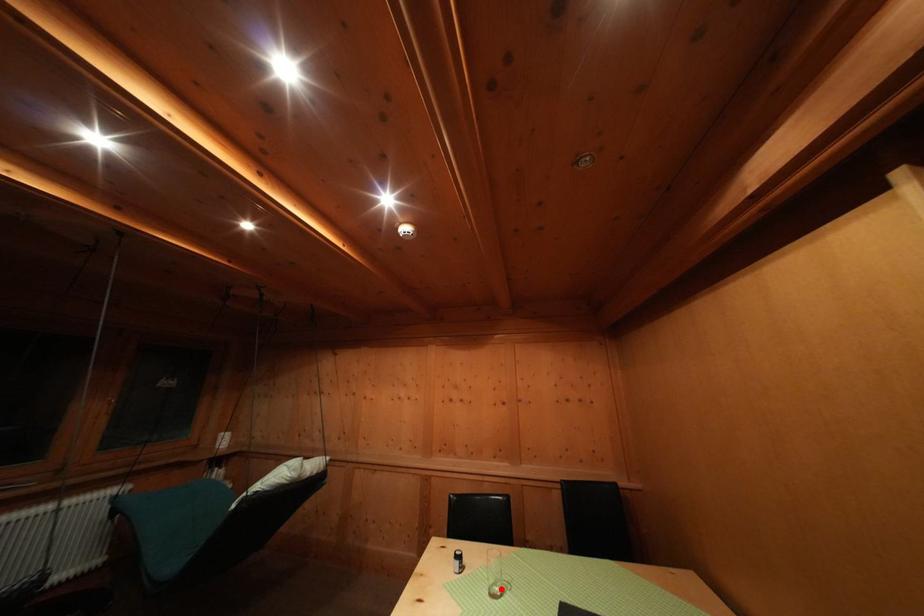
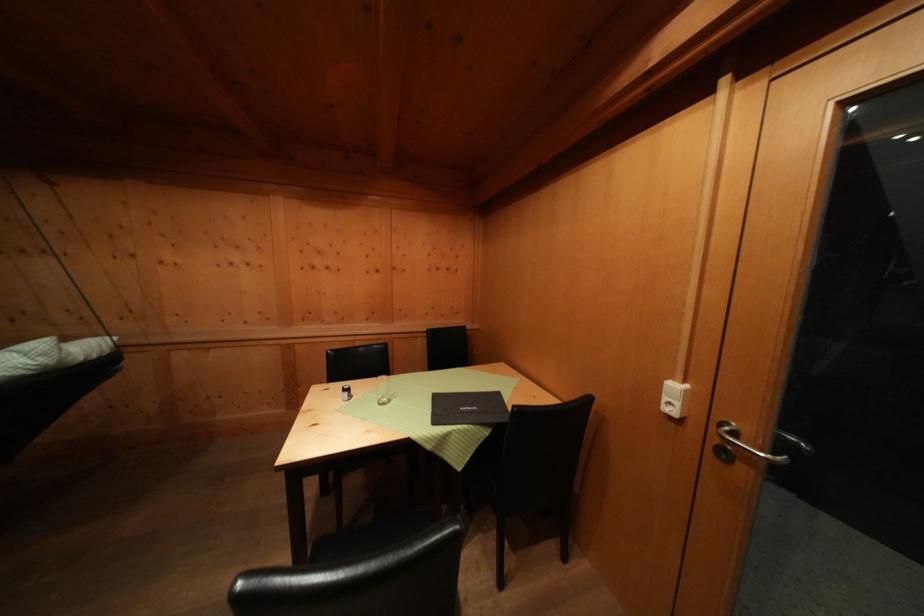
In the second image, find the point that corresponds to the highlighted location in the first image.

(388, 403)